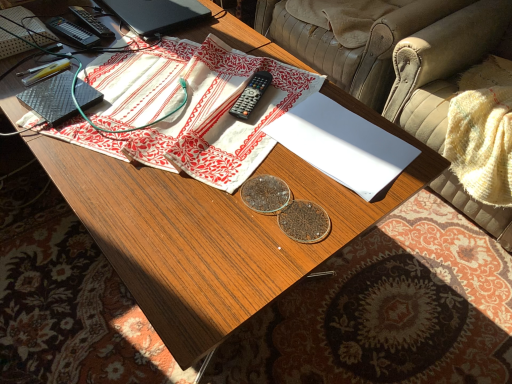
Question: Is white cotton cloth at center beside leather armchair at upper right, placed as the 1th armchair when sorted from back to front?

Choices:
 (A) yes
 (B) no

Answer: (B)

Question: Considering the relative sizes of white cotton cloth at center and leather armchair at upper right, placed as the 1th armchair when sorted from back to front, in the image provided, is white cotton cloth at center wider than leather armchair at upper right, placed as the 1th armchair when sorted from back to front,?

Choices:
 (A) no
 (B) yes

Answer: (A)

Question: From the image's perspective, would you say white cotton cloth at center is positioned over leather armchair at upper right, the second armchair from the front?

Choices:
 (A) yes
 (B) no

Answer: (B)

Question: Would you say white cotton cloth at center is a long distance from leather armchair at upper right, placed as the 1th armchair when sorted from back to front?

Choices:
 (A) yes
 (B) no

Answer: (B)

Question: From the image's perspective, is white cotton cloth at center under leather armchair at upper right, placed as the 1th armchair when sorted from back to front?

Choices:
 (A) yes
 (B) no

Answer: (A)

Question: In terms of width, does white cotton cloth at center look wider or thinner when compared to beige leather armchair at upper right, the 2th armchair in the back-to-front sequence?

Choices:
 (A) wide
 (B) thin

Answer: (B)

Question: Is white cotton cloth at center spatially inside beige leather armchair at upper right, which is counted as the 1th armchair, starting from the front, or outside of it?

Choices:
 (A) outside
 (B) inside

Answer: (A)

Question: From a real-world perspective, is white cotton cloth at center positioned above or below beige leather armchair at upper right, the 2th armchair in the back-to-front sequence?

Choices:
 (A) below
 (B) above

Answer: (B)

Question: In the image, is white cotton cloth at center positioned in front of or behind beige leather armchair at upper right, which is counted as the 1th armchair, starting from the front?

Choices:
 (A) front
 (B) behind

Answer: (A)

Question: Is point (441, 190) positioned closer to the camera than point (329, 97)?

Choices:
 (A) farther
 (B) closer

Answer: (A)

Question: Considering the positions of beige leather armchair at upper right, which is counted as the 1th armchair, starting from the front, and white paper at center in the image, is beige leather armchair at upper right, which is counted as the 1th armchair, starting from the front, taller or shorter than white paper at center?

Choices:
 (A) tall
 (B) short

Answer: (A)

Question: From the image's perspective, is beige leather armchair at upper right, the 2th armchair in the back-to-front sequence, located above or below white paper at center?

Choices:
 (A) below
 (B) above

Answer: (B)

Question: Based on their positions, is beige leather armchair at upper right, the 2th armchair in the back-to-front sequence, located to the left or right of white paper at center?

Choices:
 (A) left
 (B) right

Answer: (B)

Question: In terms of height, does white paper at center look taller or shorter compared to black matte laptop at upper left?

Choices:
 (A) tall
 (B) short

Answer: (B)

Question: From the image's perspective, relative to black matte laptop at upper left, is white paper at center above or below?

Choices:
 (A) below
 (B) above

Answer: (A)